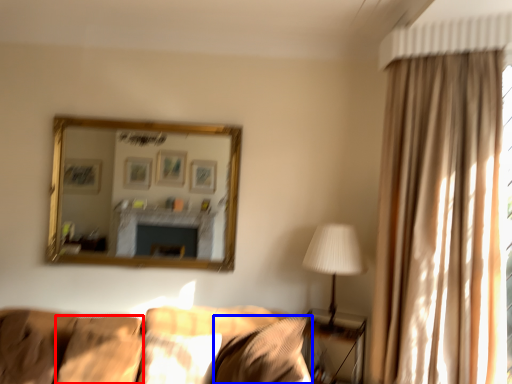
Question: Which point is closer to the camera, pillow (highlighted by a red box) or pillow (highlighted by a blue box)?

Choices:
 (A) pillow
 (B) pillow

Answer: (B)